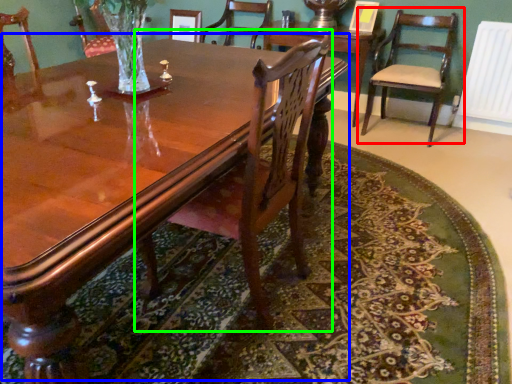
Question: Based on their relative distances, which object is farther from chair (highlighted by a red box)? Choose from coffee table (highlighted by a blue box) and chair (highlighted by a green box).

Choices:
 (A) coffee table
 (B) chair

Answer: (B)